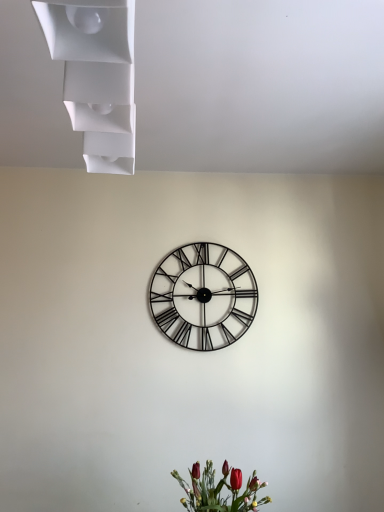
Question: Is matte red flowers at lower center shorter than metallic black clock at center?

Choices:
 (A) yes
 (B) no

Answer: (A)

Question: Is matte red flowers at lower center surrounding metallic black clock at center?

Choices:
 (A) no
 (B) yes

Answer: (A)

Question: Considering the relative positions of matte red flowers at lower center and metallic black clock at center in the image provided, is matte red flowers at lower center behind metallic black clock at center?

Choices:
 (A) yes
 (B) no

Answer: (B)

Question: Does matte red flowers at lower center come in front of metallic black clock at center?

Choices:
 (A) no
 (B) yes

Answer: (B)

Question: From the image's perspective, is matte red flowers at lower center over metallic black clock at center?

Choices:
 (A) yes
 (B) no

Answer: (B)

Question: From the image's perspective, is matte red flowers at lower center beneath metallic black clock at center?

Choices:
 (A) yes
 (B) no

Answer: (A)

Question: Is matte red flowers at lower center to the left of white matte shelf at upper left from the viewer's perspective?

Choices:
 (A) no
 (B) yes

Answer: (A)

Question: Is matte red flowers at lower center aimed at white matte shelf at upper left?

Choices:
 (A) no
 (B) yes

Answer: (A)

Question: Is matte red flowers at lower center to the right of white matte shelf at upper left from the viewer's perspective?

Choices:
 (A) yes
 (B) no

Answer: (A)

Question: Is matte red flowers at lower center behind white matte shelf at upper left?

Choices:
 (A) no
 (B) yes

Answer: (B)

Question: From the image's perspective, would you say matte red flowers at lower center is positioned over white matte shelf at upper left?

Choices:
 (A) yes
 (B) no

Answer: (B)

Question: Considering the relative sizes of matte red flowers at lower center and white matte shelf at upper left in the image provided, is matte red flowers at lower center smaller than white matte shelf at upper left?

Choices:
 (A) no
 (B) yes

Answer: (A)

Question: Would you say metallic black clock at center is outside white matte shelf at upper left?

Choices:
 (A) no
 (B) yes

Answer: (B)